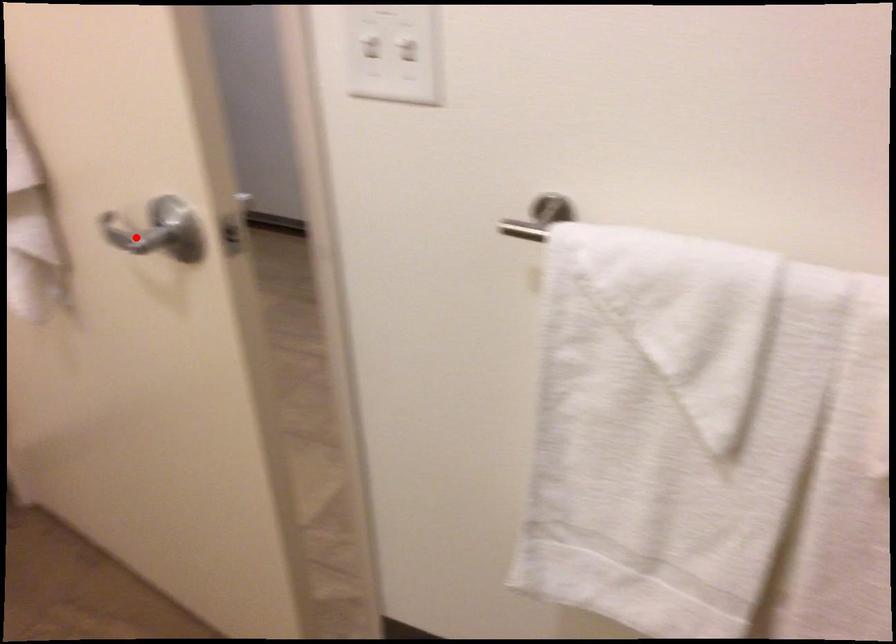
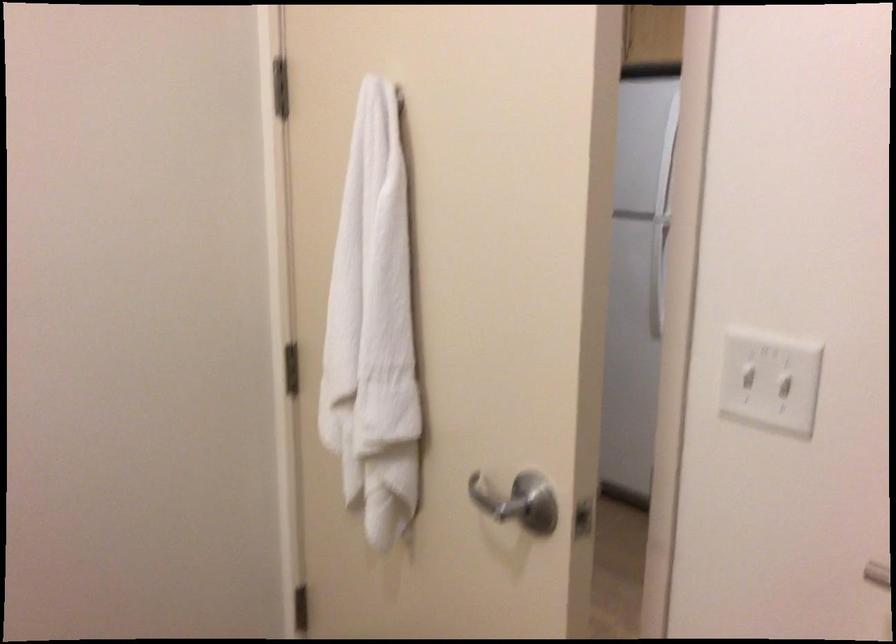
Question: I am providing you with two images of the same scene from different viewpoints. A red point is marked on the first image. At the location where the point appears in image 1, is it still visible in image 2?

Choices:
 (A) Yes
 (B) No

Answer: (A)